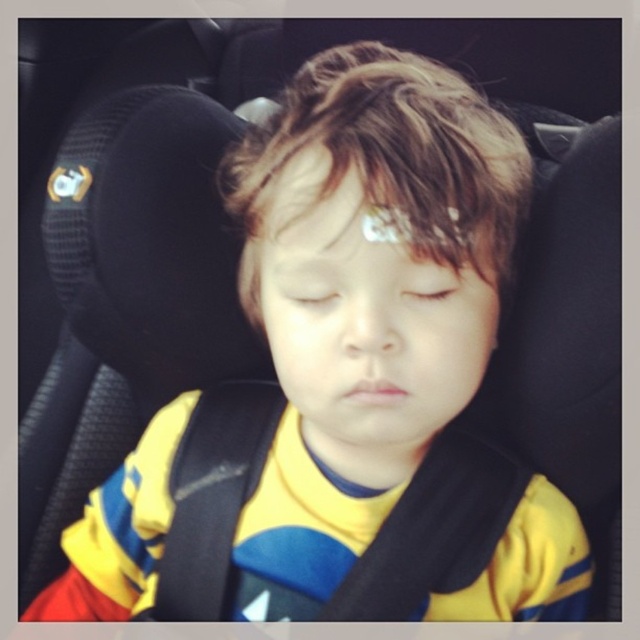
Question: Observing the image, what is the correct spatial positioning of matte white forehead at center in reference to transparent plastic eye at center?

Choices:
 (A) right
 (B) left

Answer: (A)

Question: Which point is farther to the camera?

Choices:
 (A) light brown skin at center
 (B) matte white forehead at center

Answer: (A)

Question: Which point is closer to the camera taking this photo?

Choices:
 (A) (278, 180)
 (B) (332, 308)

Answer: (B)

Question: Is matte white forehead at center to the right of light brown skin at center from the viewer's perspective?

Choices:
 (A) yes
 (B) no

Answer: (B)

Question: Is transparent plastic eye at center above light brown skin at center?

Choices:
 (A) yes
 (B) no

Answer: (B)

Question: Which is farther from the light brown skin at center?

Choices:
 (A) matte white forehead at center
 (B) transparent plastic eye at center

Answer: (B)